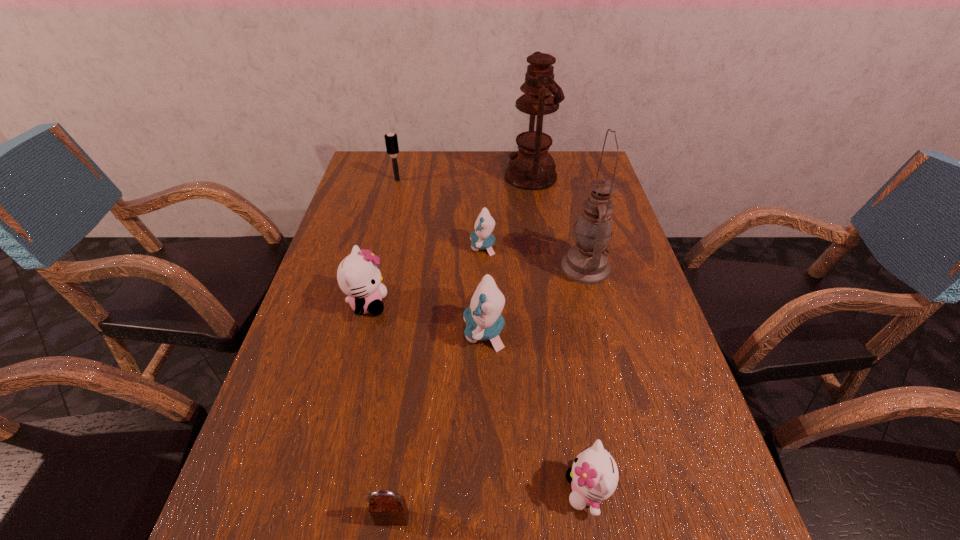
What are the coordinates of `object located in the far right corner section of the desktop` in the screenshot? It's located at (530, 168).

Image resolution: width=960 pixels, height=540 pixels. In order to click on free space at the far edge in this screenshot , I will do pos(415,185).

Identify the location of vacant region at the left edge. click(x=366, y=229).

In the image, there is a desktop. Where is `free space at the right edge`? Image resolution: width=960 pixels, height=540 pixels. free space at the right edge is located at coordinates (651, 357).

I want to click on vacant area at the far left corner of the desktop, so click(394, 183).

The image size is (960, 540). I want to click on free location at the far right corner of the desktop, so pos(595,153).

Where is `free point between the brown padlock and the nearer oil lamp`? The image size is (960, 540). free point between the brown padlock and the nearer oil lamp is located at coordinates (489, 393).

Image resolution: width=960 pixels, height=540 pixels. Find the location of `vacant area that lies between the padlock and the farthest kitten`. vacant area that lies between the padlock and the farthest kitten is located at coordinates (438, 382).

What are the coordinates of `free space between the farther oil lamp and the gray oil lamp` in the screenshot? It's located at (558, 222).

You are a GUI agent. You are given a task and a screenshot of the screen. Output one action in this format:
    pyautogui.click(x=<x>, y=<y>)
    Task: Click on the vacant region between the farther oil lamp and the padlock
    This screenshot has width=960, height=540.
    Given the screenshot: What is the action you would take?
    pyautogui.click(x=462, y=347)